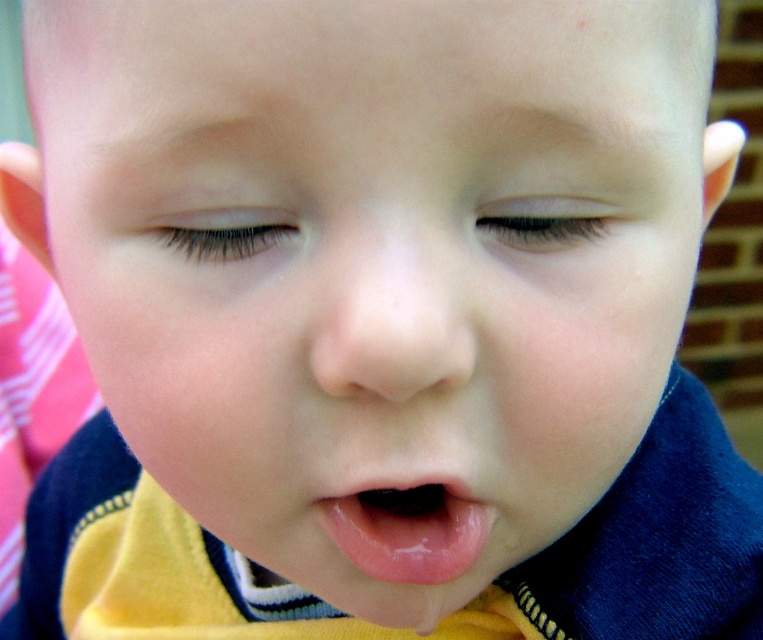
Looking at this image, you are a photographer trying to focus on the child in the image. The camera has a focus point at point (390, 314). What part of the child is the focus point currently on?

The focus point at (390, 314) is on the smooth flesh colored nose at center.

Looking at this image, you are a photographer adjusting the focus of your camera. You want to ensure both the smooth skin eye at center and the black eyelashes at upper center are in focus. Given that your camera has a depth of field that can cover 3 inches, will both objects be in focus?

The smooth skin eye at center is 2.76 inches from the black eyelashes at upper center. Since the distance between them is less than the 3 inch depth of field, both objects will be in focus.